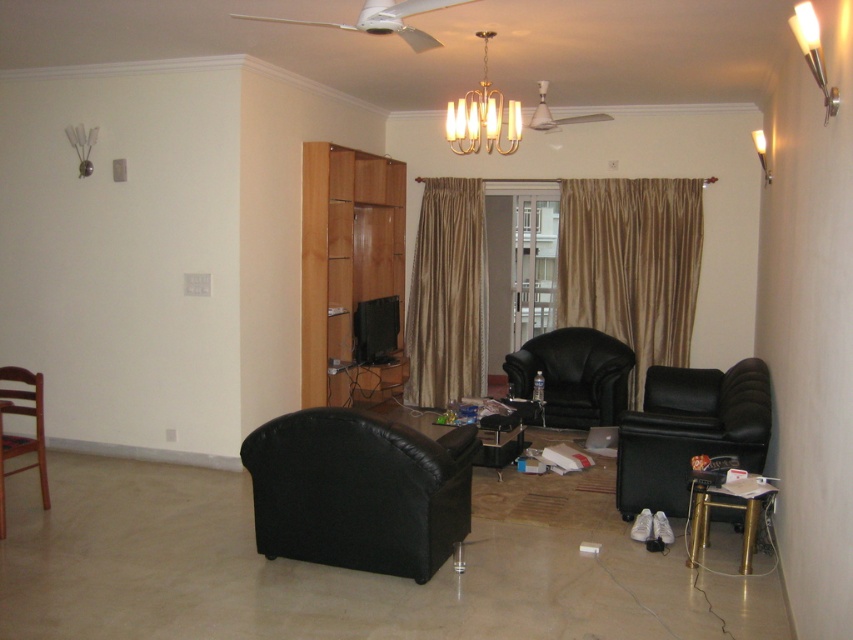
Is black leather armchair at center wider than brown wooden chair at left?

Yes, black leather armchair at center is wider than brown wooden chair at left.

Who is lower down, black leather armchair at center or brown wooden chair at left?

A: brown wooden chair at left is lower down.

You are a GUI agent. You are given a task and a screenshot of the screen. Output one action in this format:
    pyautogui.click(x=<x>, y=<y>)
    Task: Click on the black leather armchair at center
    
    Given the screenshot: What is the action you would take?
    pyautogui.click(x=573, y=376)

Which is below, gold metallic chandelier at upper center or brown wooden chair at left?

brown wooden chair at left

Does point (451, 148) come behind point (38, 420)?

Yes, it is behind point (38, 420).

Identify the location of gold metallic chandelier at upper center. The height and width of the screenshot is (640, 853). (482, 115).

Is brown textured curtain at right taller than gold silk curtain at center?

Incorrect, brown textured curtain at right's height is not larger of gold silk curtain at center's.

Where is `brown textured curtain at right`? brown textured curtain at right is located at coordinates (631, 266).